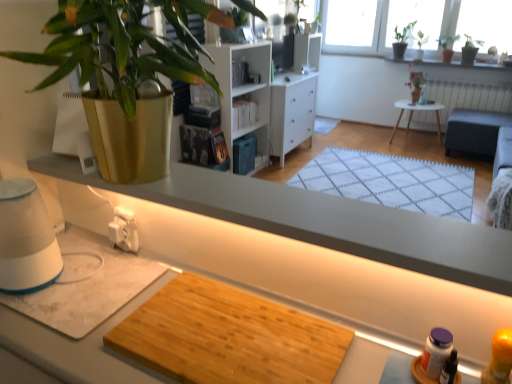
Question: Considering the relative sizes of green leafy plant at upper right, which is counted as the second houseplant, starting from the top, and green leafy plant at upper right, the fourth houseplant when ordered from bottom to top, in the image provided, is green leafy plant at upper right, which is counted as the second houseplant, starting from the top, thinner than green leafy plant at upper right, the fourth houseplant when ordered from bottom to top,?

Choices:
 (A) yes
 (B) no

Answer: (B)

Question: Can you confirm if green leafy plant at upper right, which appears as the second houseplant when viewed from the right, is shorter than green leafy plant at upper right, marked as the first houseplant in a back-to-front arrangement?

Choices:
 (A) no
 (B) yes

Answer: (B)

Question: Is green leafy plant at upper right, which is the third houseplant from left to right, positioned behind green leafy plant at upper right, marked as the 1th houseplant in a top-to-bottom arrangement?

Choices:
 (A) no
 (B) yes

Answer: (A)

Question: From a real-world perspective, is green leafy plant at upper right, which is the second houseplant from back to front, positioned under green leafy plant at upper right, marked as the first houseplant in a back-to-front arrangement, based on gravity?

Choices:
 (A) yes
 (B) no

Answer: (A)

Question: Does green leafy plant at upper right, which appears as the second houseplant when viewed from the right, have a larger size compared to green leafy plant at upper right, which ranks as the fourth houseplant in front-to-back order?

Choices:
 (A) yes
 (B) no

Answer: (B)

Question: Is point (138, 357) positioned closer to the camera than point (463, 196)?

Choices:
 (A) farther
 (B) closer

Answer: (B)

Question: In terms of width, does wooden cutting board at center look wider or thinner when compared to white woven mat at center?

Choices:
 (A) wide
 (B) thin

Answer: (B)

Question: Based on their sizes in the image, would you say wooden cutting board at center is bigger or smaller than white woven mat at center?

Choices:
 (A) small
 (B) big

Answer: (A)

Question: Visually, is wooden cutting board at center positioned to the left or to the right of white woven mat at center?

Choices:
 (A) right
 (B) left

Answer: (B)

Question: From a real-world perspective, is gold metallic pot at upper left, positioned as the 1th houseplant in front-to-back order, positioned above or below green leafy plant at upper right, the second houseplant when ordered from left to right?

Choices:
 (A) above
 (B) below

Answer: (A)

Question: Considering the positions of point (75, 0) and point (404, 41), is point (75, 0) closer or farther from the camera than point (404, 41)?

Choices:
 (A) closer
 (B) farther

Answer: (A)

Question: In terms of width, does gold metallic pot at upper left, positioned as the 4th houseplant in right-to-left order, look wider or thinner when compared to green leafy plant at upper right, the 3th houseplant from the right?

Choices:
 (A) wide
 (B) thin

Answer: (A)

Question: Considering their positions, is gold metallic pot at upper left, marked as the 1th houseplant in a left-to-right arrangement, located in front of or behind green leafy plant at upper right, the second houseplant when ordered from left to right?

Choices:
 (A) front
 (B) behind

Answer: (A)

Question: Is wooden cutting board at center taller or shorter than white painted radiator at upper right?

Choices:
 (A) short
 (B) tall

Answer: (B)

Question: From a real-world perspective, is wooden cutting board at center positioned above or below white painted radiator at upper right?

Choices:
 (A) below
 (B) above

Answer: (B)